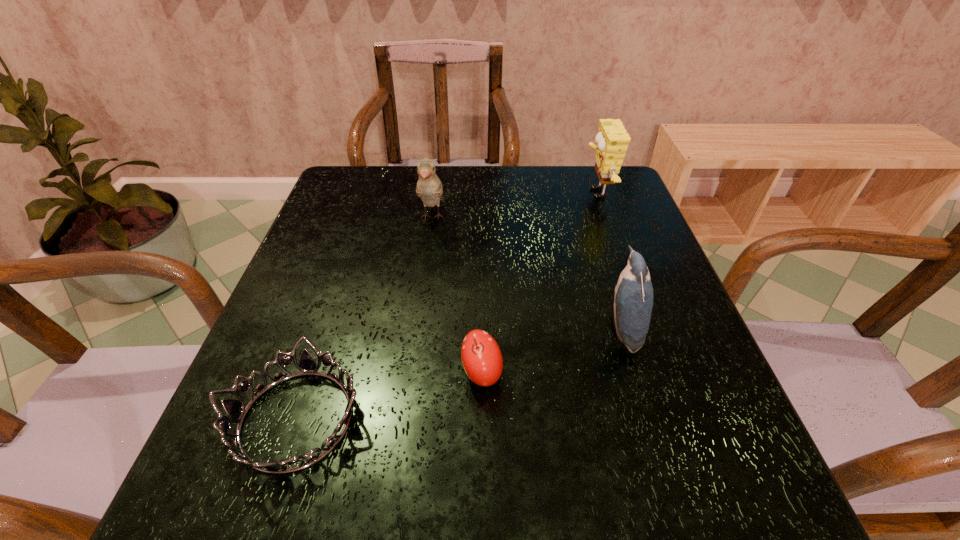
Find the location of a particular element. vacant space located 0.100m on the front-facing side of the sponge is located at coordinates (543, 193).

Where is `free location located 0.200m at the face of the second object from left to right`? The height and width of the screenshot is (540, 960). free location located 0.200m at the face of the second object from left to right is located at coordinates tap(421, 294).

The width and height of the screenshot is (960, 540). I want to click on free space located at the tip of the right bird's beak, so click(533, 329).

Locate an element on the screen. The width and height of the screenshot is (960, 540). blank area located 0.370m at the tip of the right bird's beak is located at coordinates (413, 329).

At what (x,y) coordinates should I click in order to perform the action: click on free region located 0.170m at the tip of the right bird's beak. Please return your answer as a coordinate pair (x, y). Looking at the image, I should click on (516, 329).

This screenshot has height=540, width=960. What are the coordinates of `free space located 0.300m on the back of the apple` in the screenshot? It's located at tap(481, 248).

Image resolution: width=960 pixels, height=540 pixels. Identify the location of vacant space situated 0.230m on the front-facing side of the leftmost object. (508, 420).

The width and height of the screenshot is (960, 540). Identify the location of sponge situated at the far edge. (612, 140).

In order to click on bird at the far edge in this screenshot , I will do `click(429, 187)`.

Locate an element on the screen. Image resolution: width=960 pixels, height=540 pixels. object that is at the near edge is located at coordinates (235, 409).